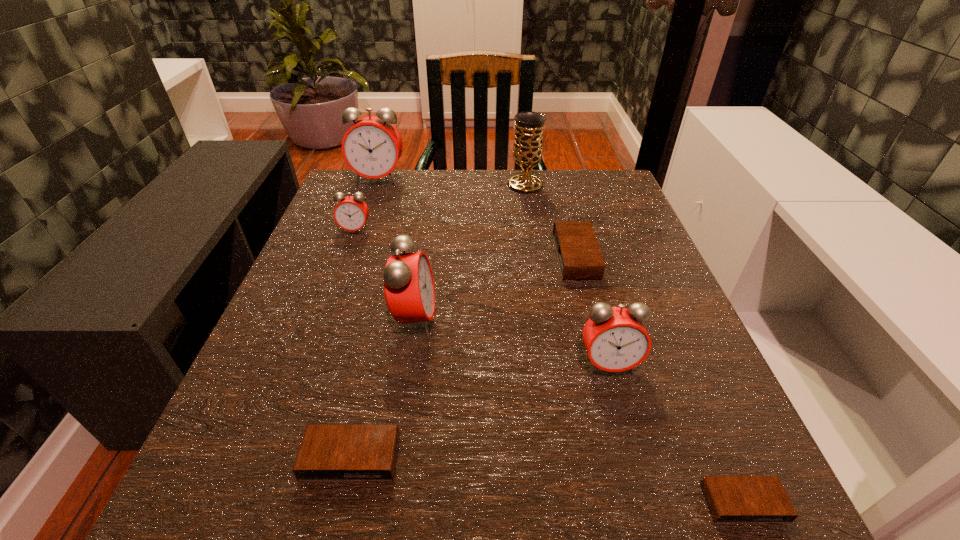
Identify the location of vacant space at the left edge. (373, 241).

In the image, there is a desktop. Identify the location of vacant area at the right edge. The height and width of the screenshot is (540, 960). (645, 264).

Locate an element on the screen. The width and height of the screenshot is (960, 540). vacant space at the far left corner of the desktop is located at coordinates (379, 214).

In order to click on vacant space at the far right corner of the desktop in this screenshot , I will do `click(568, 208)`.

You are a GUI agent. You are given a task and a screenshot of the screen. Output one action in this format:
    pyautogui.click(x=<x>, y=<y>)
    Task: Click on the free area in between the chalice and the biggest red alarm clock
    
    Given the screenshot: What is the action you would take?
    pyautogui.click(x=452, y=183)

Locate an element on the screen. The height and width of the screenshot is (540, 960). vacant area that lies between the biggest red alarm clock and the fourth tallest object is located at coordinates (493, 272).

Locate an element on the screen. free space between the sixth farthest alarm clock and the second biggest red alarm clock is located at coordinates (383, 389).

Identify the location of vacant area that lies between the biggest red alarm clock and the second black alarm clock from right to left. (477, 218).

Find the location of a particular element. empty space that is in between the seventh farthest object and the nearest red alarm clock is located at coordinates (480, 411).

This screenshot has height=540, width=960. I want to click on unoccupied area between the chalice and the seventh tallest object, so click(x=438, y=321).